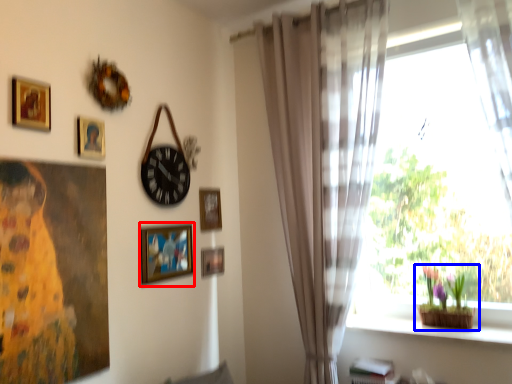
Question: Which point is further to the camera, picture frame (highlighted by a red box) or houseplant (highlighted by a blue box)?

Choices:
 (A) picture frame
 (B) houseplant

Answer: (B)